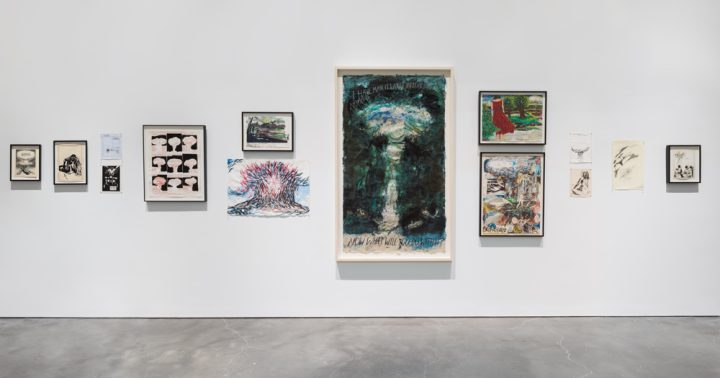
This screenshot has height=378, width=720. What are the coordinates of `gallery` in the screenshot? It's located at (366, 178).